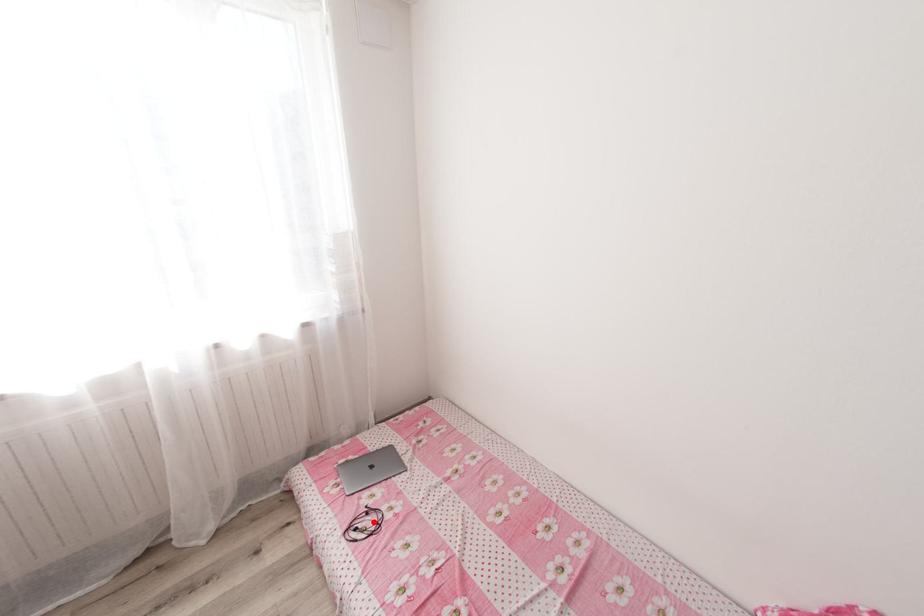
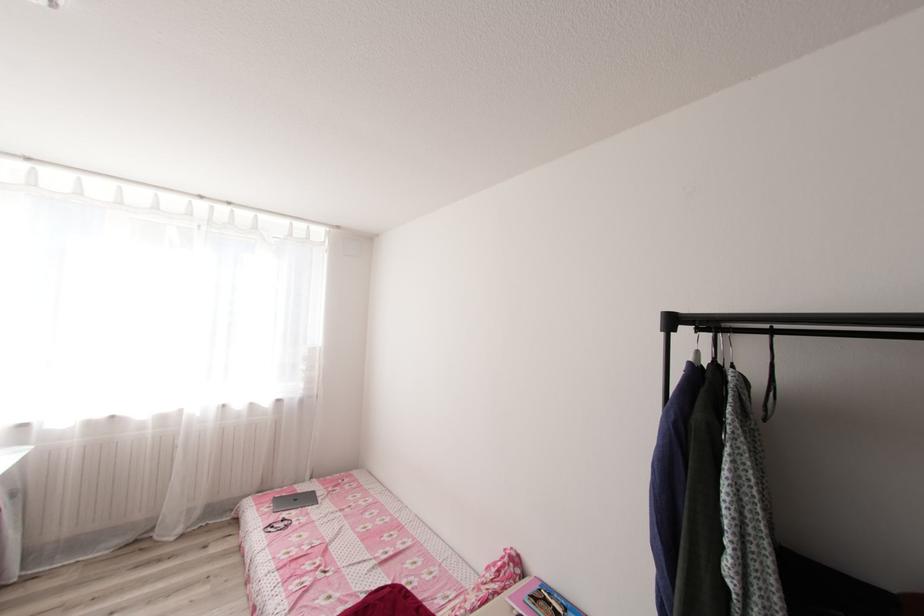
Find the pixel in the second image that matches the highlighted location in the first image.

(286, 525)